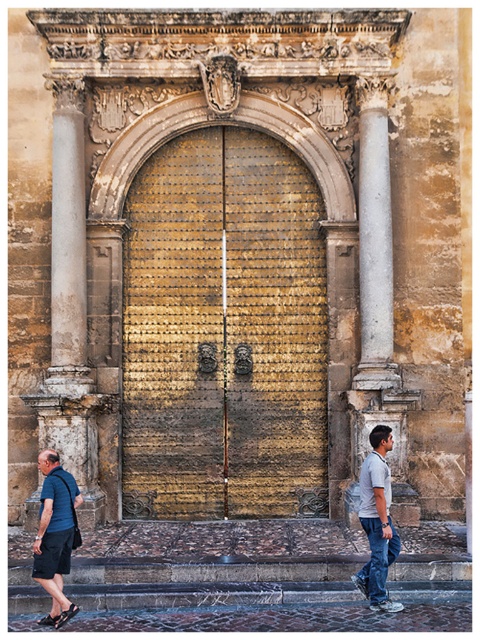
You are standing in front of the entrance door and want to locate two specific points marked on the door. The first point is at coordinate point [239,148] and the second is at point [48,582]. From your perspective facing the door, which point is closer to you?

Point [48,582] is closer to you because point [239,148] is behind it.

You are a visitor standing at the entrance of this building. You see the white marble column at right and the denim jeans at lower right. Which object is taller?

The white marble column at right is taller than the denim jeans at lower right.

You are a security guard standing at the entrance. You notice the gold textured door at center and the matte blue shirt at lower left. Which object is located higher in the image?

The gold textured door at center is positioned over the matte blue shirt at lower left, so it is higher in the image.